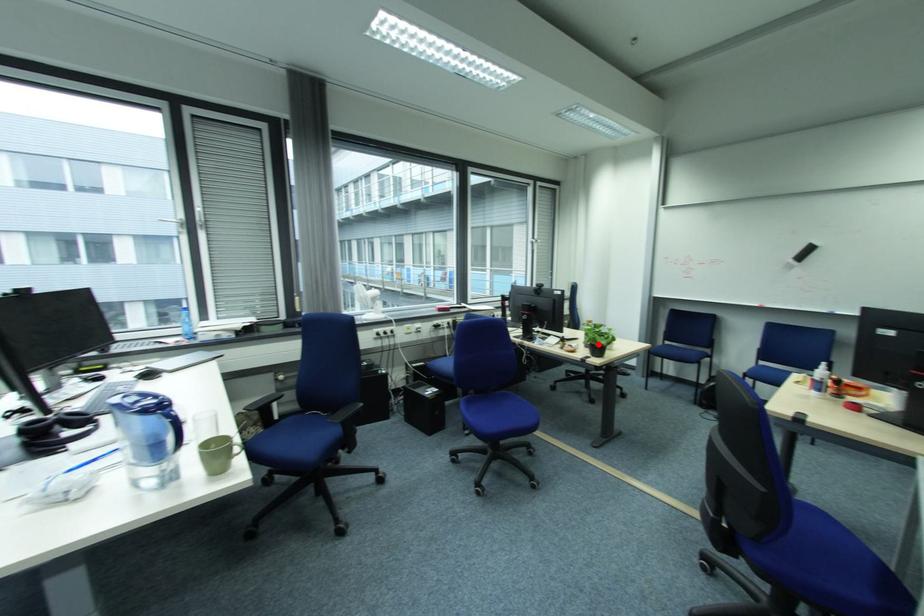
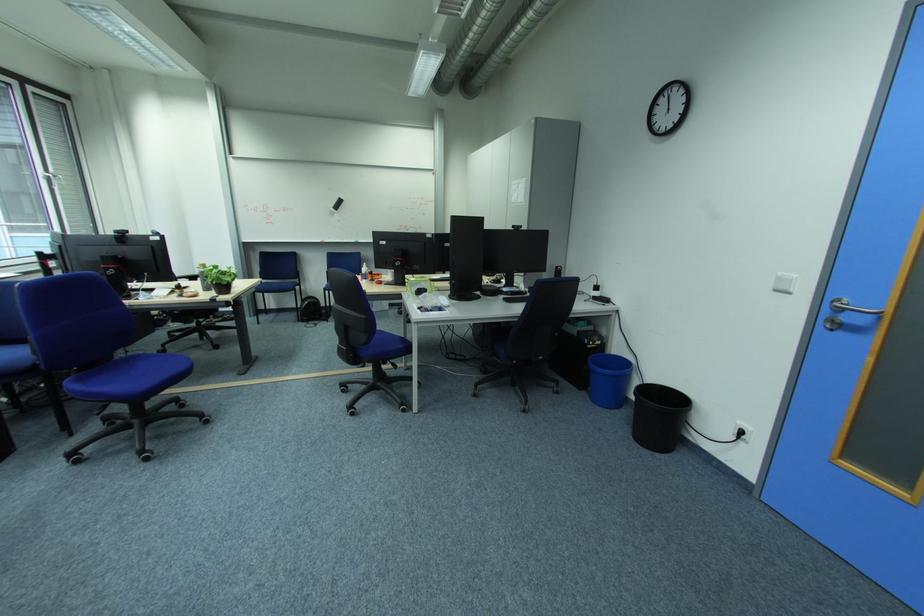
Where in the second image is the point corresponding to the highlighted location from the first image?

(224, 284)